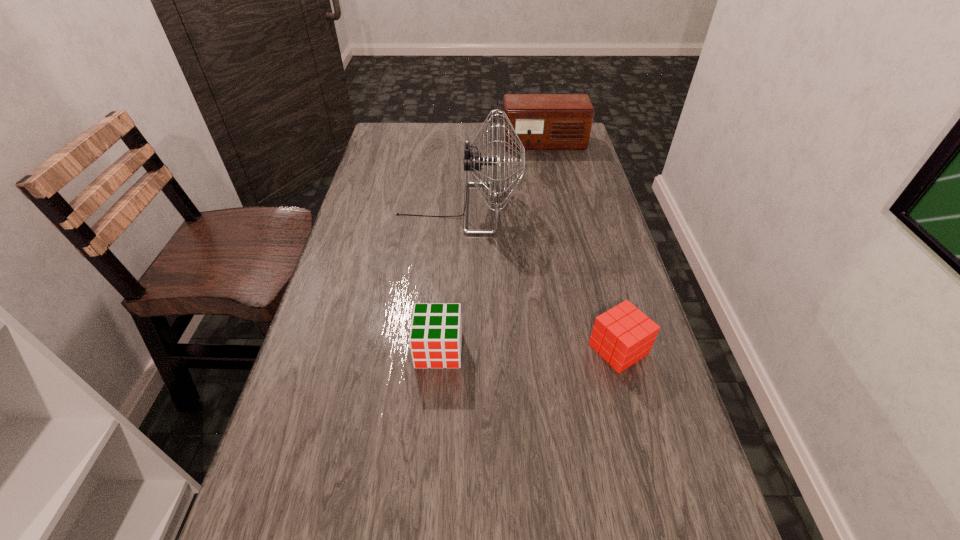
What are the coordinates of `vacant space that satisfies the following two spatial constraints: 1. on the front-facing side of the tallest object; 2. on the red face of the left cube` in the screenshot? It's located at (450, 350).